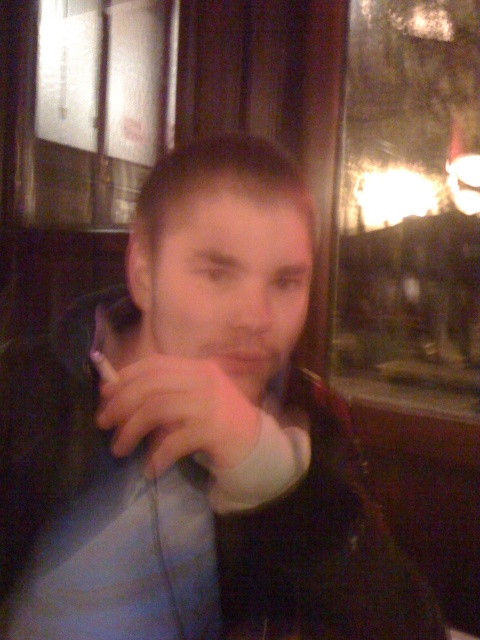
You are a photographer trying to capture the scene. You notice the matte black phone at center and the white matte hand at center. Which object is positioned higher in the image?

The matte black phone at center is located above the white matte hand at center, so it is positioned higher in the image.

You are a photographer who wants to capture the scene without the matte black phone at center appearing in the photo. Since the phone is located at point 0.686 on the horizontal axis and 0.404 on the vertical axis, where should you position your camera to avoid it?

To avoid capturing the matte black phone at center, position the camera away from the area around point 0.686 on the horizontal axis and 0.404 on the vertical axis, ensuring it is outside the camera frame.

You are a photographer trying to capture a closeup shot of the matte black phone at center and the white matte hand at center. Since you want to focus on the phone, which object should you ensure is not blocking the camera lens?

The white matte hand at center should not block the camera lens because the matte black phone at center is larger in size than the white matte hand at center, making it the primary focus.